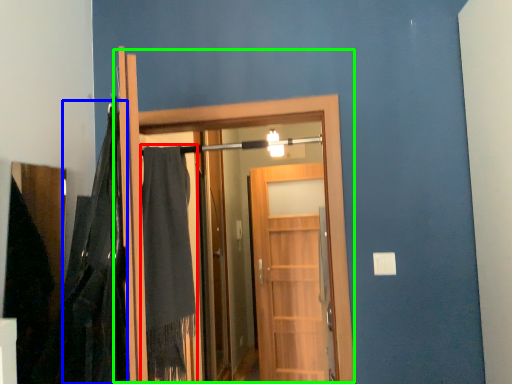
Question: Based on their relative distances, which object is nearer to robe (highlighted by a red box)? Choose from blanket (highlighted by a blue box) and door (highlighted by a green box).

Choices:
 (A) blanket
 (B) door

Answer: (B)